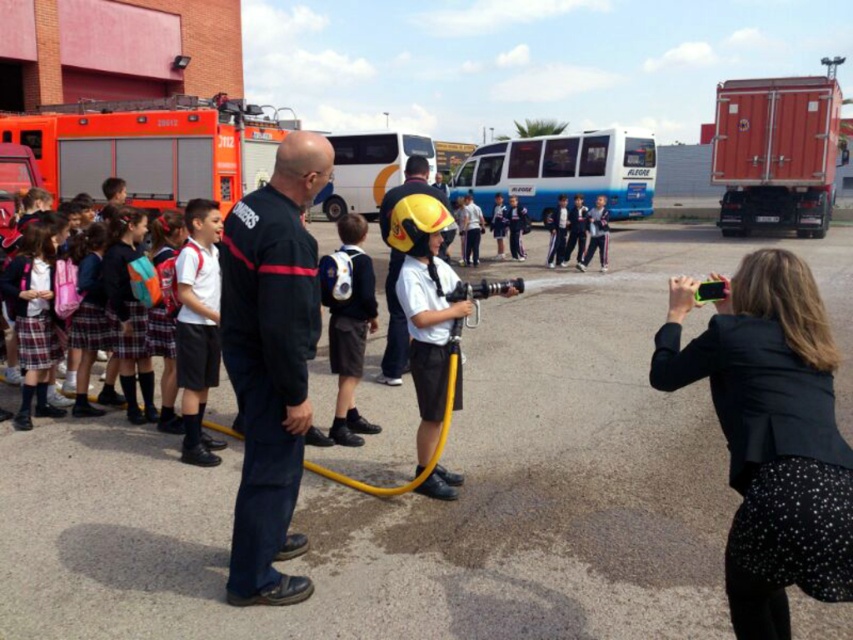
You are a photographer trying to capture a photo of the black uniform at center and the yellow matte helmet at center. Since you want both subjects to be clearly visible, which one should you focus on first if the camera can only focus on one subject at a time?

The black uniform at center is positioned on the left side of yellow matte helmet at center, so you should focus on the black uniform at center first as it is closer to the left side.

What object is located at the coordinates point (770, 465) in the image?

The point (770, 465) marks the black textured blazer at lower right.